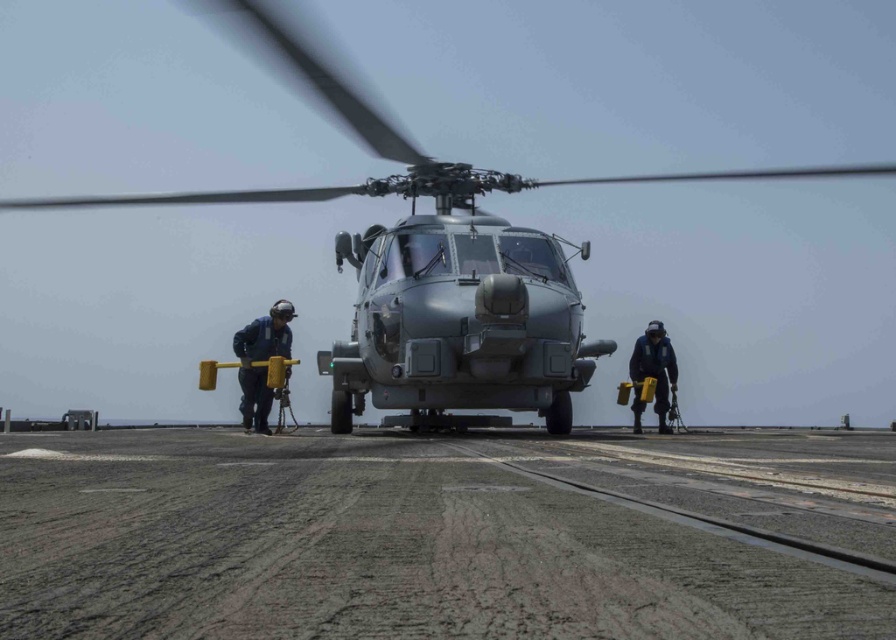
You are a crew member on the deck of the aircraft carrier. You need to move from the point at coordinates point (254, 346) to the point at coordinates point (636, 353). In which direction should you move?

You should move backward because point (254, 346) is in front of point (636, 353), so moving backward will take you towards the latter.

You are a naval engineer assessing the deck space of the aircraft carrier. The metallic gray helicopter at center requires a minimum width of 12 meters to maneuver. Given the dark blue uniform at right is 0.5 meters wide, can the helicopter safely maneuver on the deck?

The metallic gray helicopter at center is wider than the dark blue uniform at right, which is 0.5 meters wide. However, without knowing the exact width of the helicopter, it is impossible to determine if it meets the 12 meter requirement for safe maneuvering on the deck.